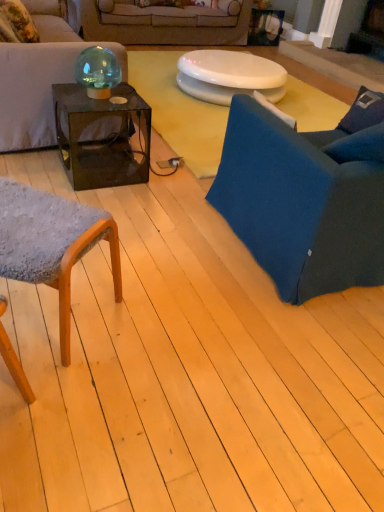
The height and width of the screenshot is (512, 384). Find the location of `blank area beneath textured gray fabric chair at lower left, which is the second chair in right-to-left order (from a real-world perspective)`. blank area beneath textured gray fabric chair at lower left, which is the second chair in right-to-left order (from a real-world perspective) is located at coordinates (52, 313).